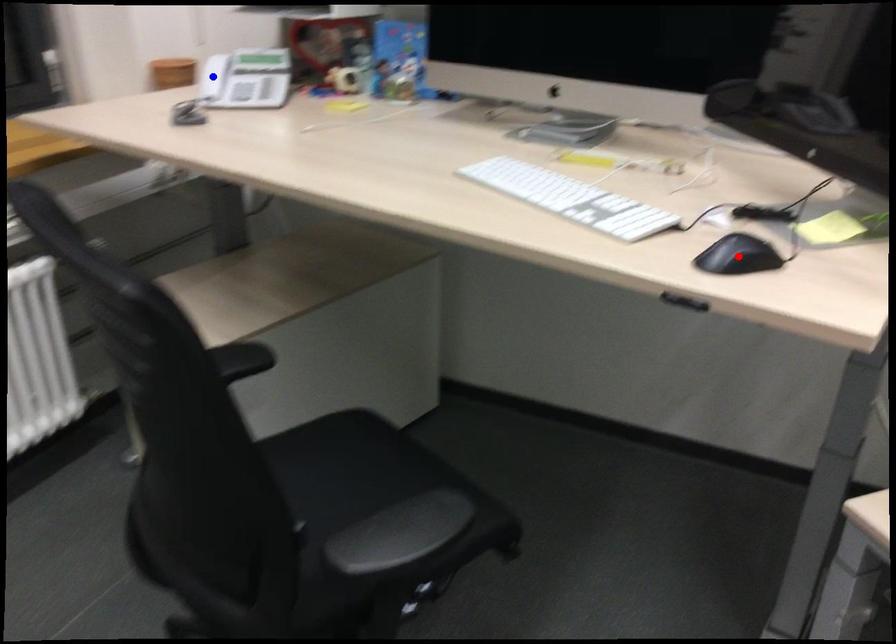
Question: In the image, two points are highlighted. Which point is nearer to the camera? Reply with the corresponding letter.

Choices:
 (A) blue point
 (B) red point

Answer: (B)